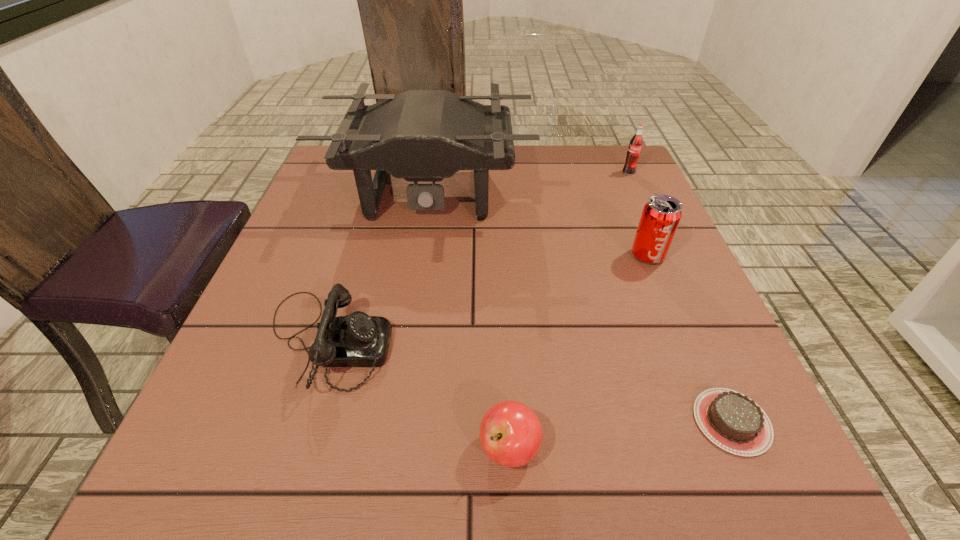
Find the location of `free space between the chocolate cake and the apple`. free space between the chocolate cake and the apple is located at coordinates (620, 435).

Identify the location of free spot between the tallest object and the shortest object. This screenshot has height=540, width=960. (581, 308).

The width and height of the screenshot is (960, 540). I want to click on vacant space that is in between the apple and the farther soda bottle, so click(569, 310).

What are the coordinates of `empty space that is in between the nearer soda bottle and the telephone` in the screenshot? It's located at (487, 299).

The height and width of the screenshot is (540, 960). What are the coordinates of `empty space that is in between the farther soda bottle and the third farthest object` in the screenshot? It's located at (638, 214).

I want to click on free space between the apple and the chocolate cake, so click(x=620, y=435).

What are the coordinates of `vacant area between the chocolate cake and the farther soda bottle` in the screenshot? It's located at (681, 297).

Where is `object that is the fifth nearest to the apple`? object that is the fifth nearest to the apple is located at coordinates (634, 150).

Locate which object is the fifth closest to the tallest object. Please provide its 2D coordinates. Your answer should be formatted as a tuple, i.e. [(x, y)], where the tuple contains the x and y coordinates of a point satisfying the conditions above.

[(510, 433)]

You are a GUI agent. You are given a task and a screenshot of the screen. Output one action in this format:
    pyautogui.click(x=<x>, y=<y>)
    Task: Click on the vacant area that satisfies the following two spatial constraints: 1. with a camera mounted on the underside of the apple; 2. on the right side of the tallest object
    The height and width of the screenshot is (540, 960).
    Given the screenshot: What is the action you would take?
    pyautogui.click(x=394, y=448)